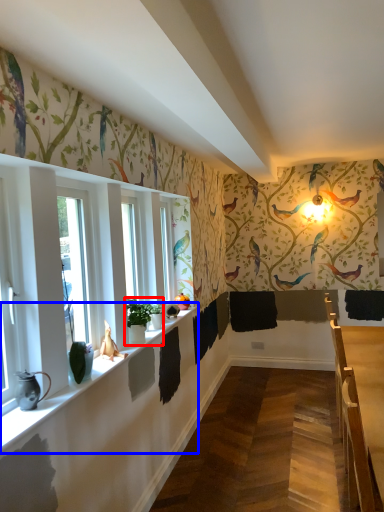
Question: Which point is further to the camera, houseplant (highlighted by a red box) or window sill (highlighted by a blue box)?

Choices:
 (A) houseplant
 (B) window sill

Answer: (A)